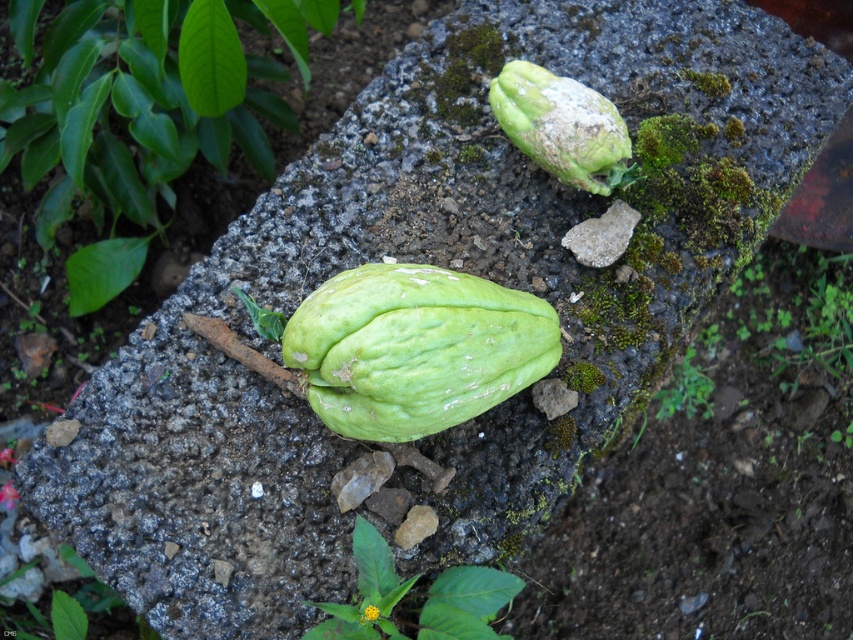
Question: Which of these objects is positioned closest to the green rough chayote at center?

Choices:
 (A) green rough chayote at upper center
 (B) green rough leaf at lower right
 (C) green rough leaf at lower center

Answer: (C)

Question: Is green rough leaf at lower center smaller than green rough leaf at lower right?

Choices:
 (A) yes
 (B) no

Answer: (B)

Question: Does green rough leaf at lower center have a greater width compared to green rough leaf at lower right?

Choices:
 (A) no
 (B) yes

Answer: (B)

Question: Does green rough fruit at center have a lesser width compared to green rough chayote at center?

Choices:
 (A) yes
 (B) no

Answer: (B)

Question: Which of the following is the farthest from the observer?

Choices:
 (A) green rough chayote at center
 (B) green rough chayote at upper center
 (C) green rough fruit at center

Answer: (C)

Question: Which of these objects is positioned farthest from the green rough chayote at center?

Choices:
 (A) green rough leaf at lower right
 (B) green rough chayote at upper center
 (C) green rough fruit at center
 (D) yellow matte flower at center

Answer: (A)